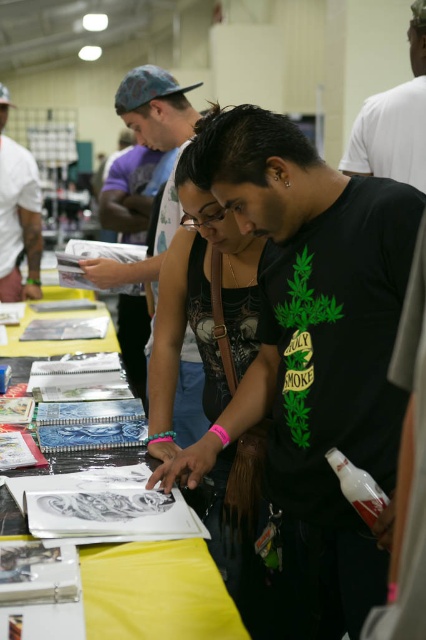
You are standing at the center of the convention hall and see a point marked at coordinates [394,120]. Which object is this point located on?

The point is located on the black matte t shirt at center.